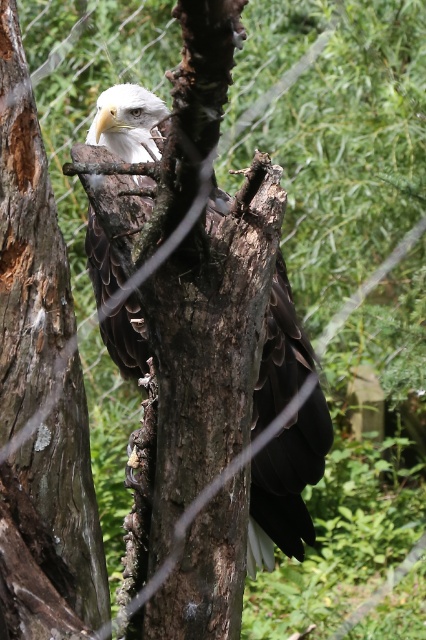
Is point (65, 346) in front of point (101, 330)?

Yes, it is.

Can you confirm if brown rough tree trunk at left is positioned below dark brown feathers at center?

Actually, brown rough tree trunk at left is above dark brown feathers at center.

Does point (28, 296) come behind point (127, 104)?

No.

At what (x,y) coordinates should I click in order to perform the action: click on brown rough tree trunk at left. Please return your answer as a coordinate pair (x, y). Image resolution: width=426 pixels, height=640 pixels. Looking at the image, I should click on (52, 528).